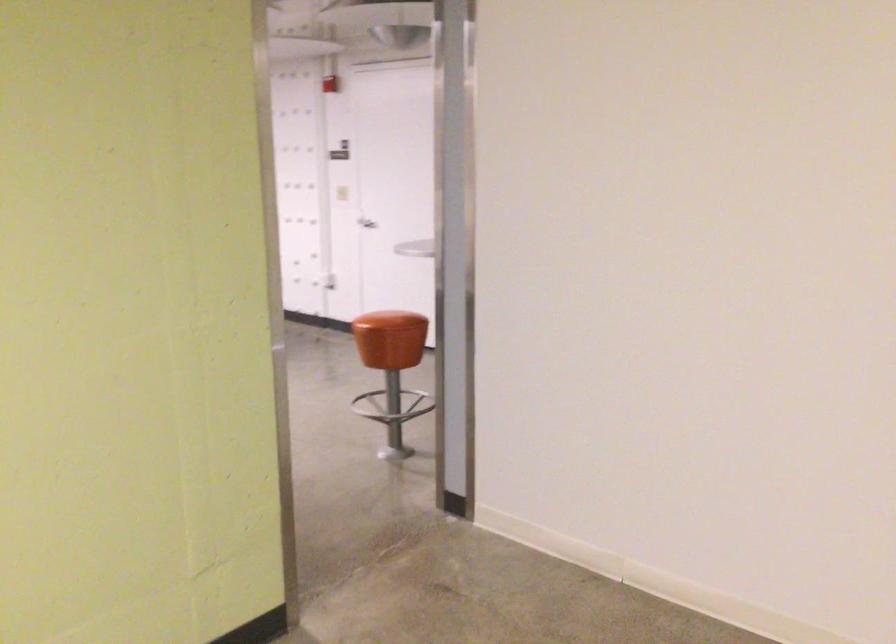
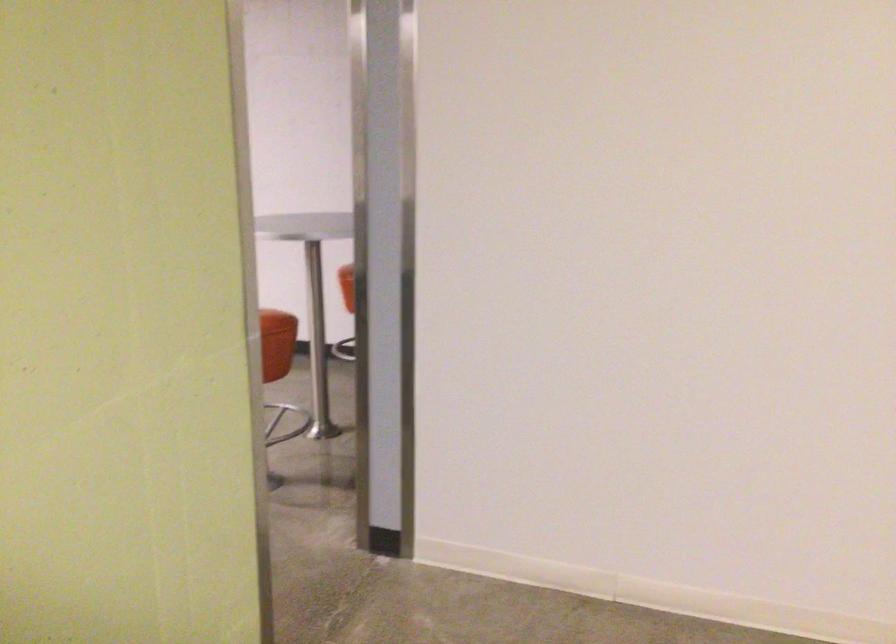
Locate, in the second image, the point that corresponds to [392,339] in the first image.

(277, 343)